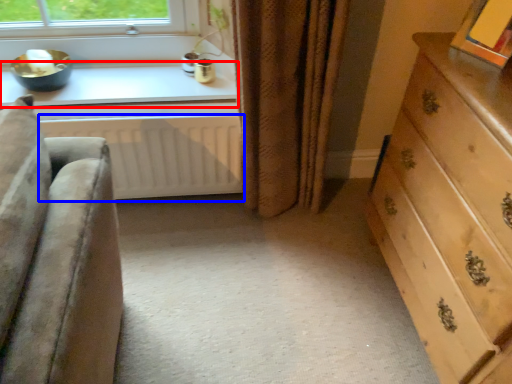
Question: Which object is further to the camera taking this photo, window sill (highlighted by a red box) or radiator (highlighted by a blue box)?

Choices:
 (A) window sill
 (B) radiator

Answer: (A)